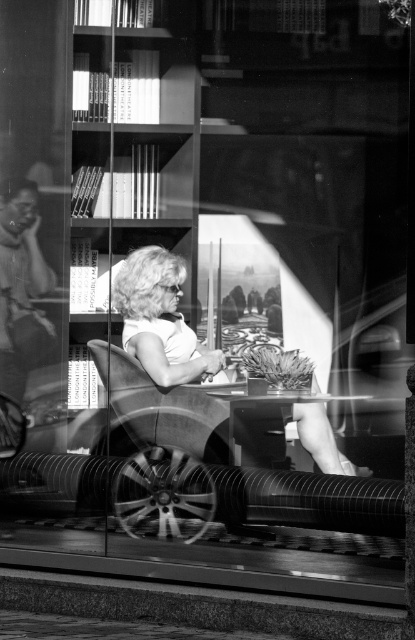
Question: Can you confirm if smooth wood park bench at center is positioned below white fabric chair at center?

Choices:
 (A) no
 (B) yes

Answer: (B)

Question: Which point appears closest to the camera in this image?

Choices:
 (A) (315, 516)
 (B) (173, 257)

Answer: (A)

Question: Does smooth wood park bench at center have a lesser width compared to white fabric chair at center?

Choices:
 (A) no
 (B) yes

Answer: (A)

Question: Is smooth wood park bench at center below white fabric chair at center?

Choices:
 (A) no
 (B) yes

Answer: (B)